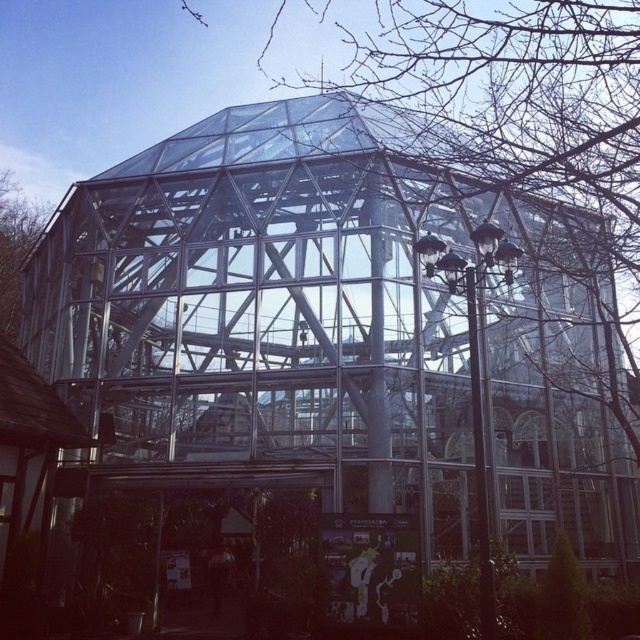
You are standing outside the building and want to know if the transparent glass dome at center can be seen from the top of the brown wood tree at left. Based on their heights, what do you think?

The transparent glass dome at center is taller than the brown wood tree at left, so from the top of the brown wood tree at left, you can see the transparent glass dome at center because it extends higher into the sky.

You are standing outside the building and want to see the brown wood tree at left through the transparent glass dome at center. Is the tree visible through the dome?

The transparent glass dome at center is in front of the brown wood tree at left, so the tree is behind the dome and may be visible through it depending on the dome material and lighting conditions. However, the description does not provide details about visibility through the dome, so we cannot confirm if the tree is visible.